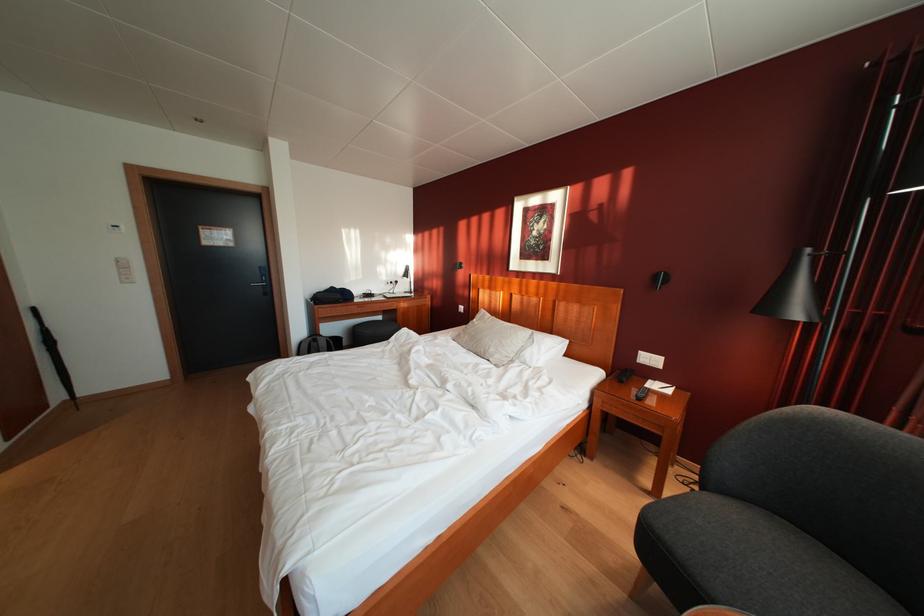
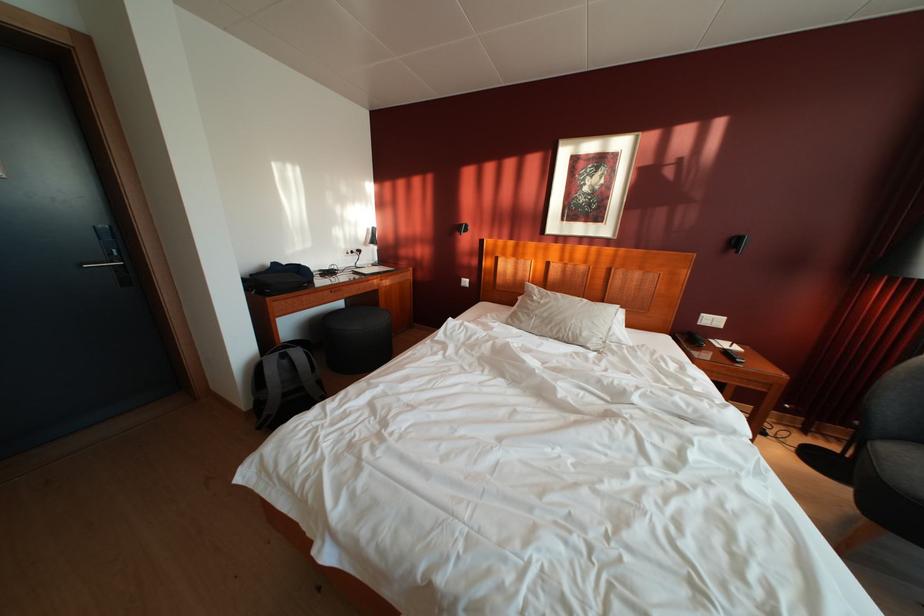
In the second image, find the point that corresponds to point (341, 294) in the first image.

(284, 270)